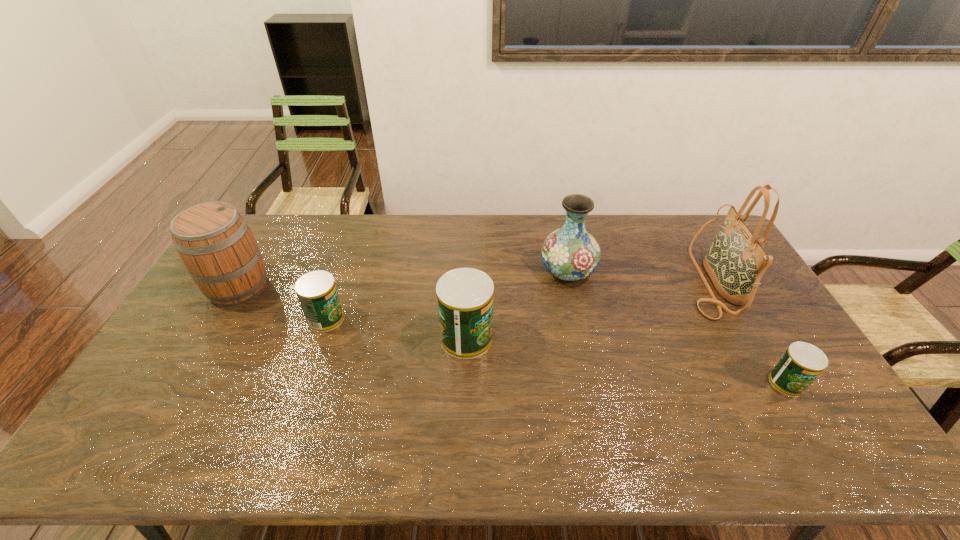
Where is `blank space located 0.360m on the left of the third object from left to right`? The height and width of the screenshot is (540, 960). blank space located 0.360m on the left of the third object from left to right is located at coordinates coord(319,338).

The image size is (960, 540). What are the coordinates of `vacant space located on the back of the shortest can` in the screenshot? It's located at (742, 308).

Where is `free location located 0.170m on the front-facing side of the handbag`? This screenshot has width=960, height=540. free location located 0.170m on the front-facing side of the handbag is located at coordinates (632, 280).

Locate an element on the screen. vacant region located 0.340m on the front-facing side of the handbag is located at coordinates (582, 280).

At what (x,y) coordinates should I click in order to perform the action: click on free region located 0.230m on the front-facing side of the handbag. Please return your answer as a coordinate pair (x, y). This screenshot has width=960, height=540. Looking at the image, I should click on (614, 280).

What are the coordinates of `free space located 0.090m on the front of the third object from right to left` in the screenshot? It's located at [x=576, y=312].

At what (x,y) coordinates should I click in order to perform the action: click on vacant region located on the front of the cider. Please return your answer as a coordinate pair (x, y). Looking at the image, I should click on (190, 373).

The image size is (960, 540). I want to click on handbag that is at the far edge, so click(735, 262).

Find the location of `vase at the far edge`. vase at the far edge is located at coordinates 570,253.

You are a GUI agent. You are given a task and a screenshot of the screen. Output one action in this format:
    pyautogui.click(x=<x>, y=<y>)
    Task: Click on the object that is at the near edge
    The width and height of the screenshot is (960, 540).
    Given the screenshot: What is the action you would take?
    point(801,364)